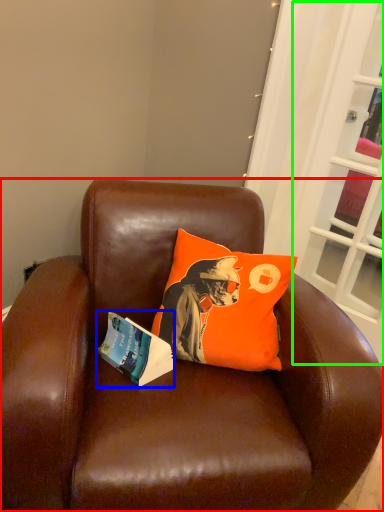
Question: Estimate the real-world distances between objects in this image. Which object is closer to chair (highlighted by a red box), book (highlighted by a blue box) or screen door (highlighted by a green box)?

Choices:
 (A) book
 (B) screen door

Answer: (A)